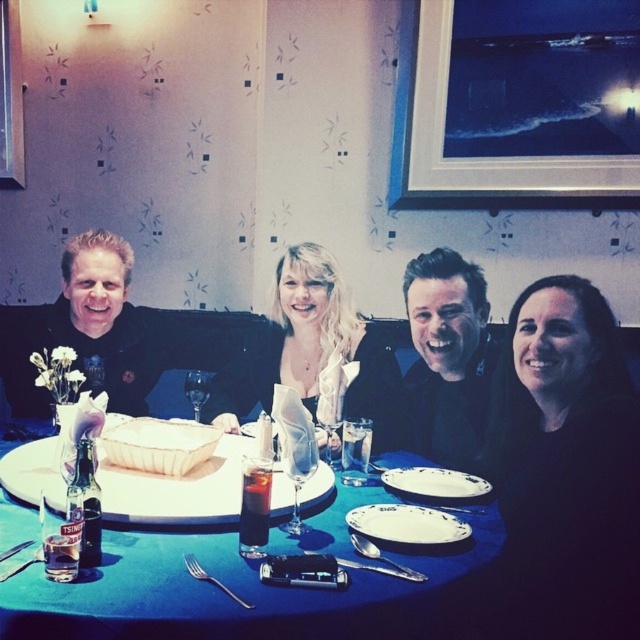
You are a waiter in a restaurant and need to place a new dessert plate on the table. The dessert plate is the same size as the white ceramic plate at center. Can you fit it on the remaining space of the black matte table at center without overlapping any existing items?

The black matte table at center is larger in size than the white ceramic plate at center, so there should be enough space to place the dessert plate without overlapping existing items.

You are a waiter in a restaurant and need to place a new order on the table. The order requires enough space to accommodate a large platter. Considering the blue fabric table at center and the matte black shirt at left, which object is more suitable for placing the platter?

The blue fabric table at center has a smaller size compared to matte black shirt at left, so the matte black shirt at left is more suitable for placing the large platter due to its larger size.

Looking at this image, you are a waiter in a restaurant and need to place a new drink order at the table located at point (243, 595). Where should you place the drink so that it is on the blue fabric table at center?

The blue fabric table at center is located at point (243, 595), so you should place the drink on the blue fabric table at center at that coordinate.